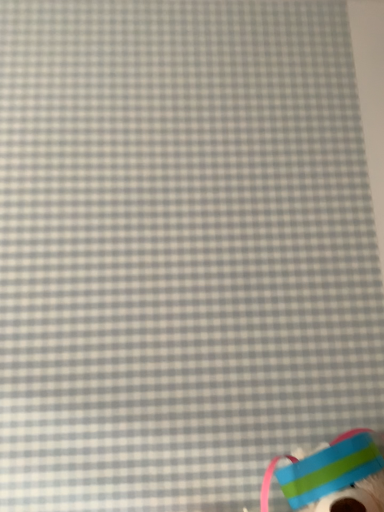
Question: Should I look upward or downward to see plush toy with colorful bands at bottom right?

Choices:
 (A) up
 (B) down

Answer: (B)